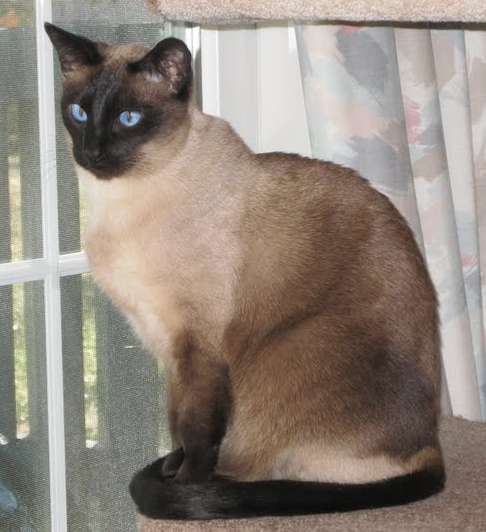
Where is `carpet`? This screenshot has width=486, height=532. carpet is located at coordinates (464, 468).